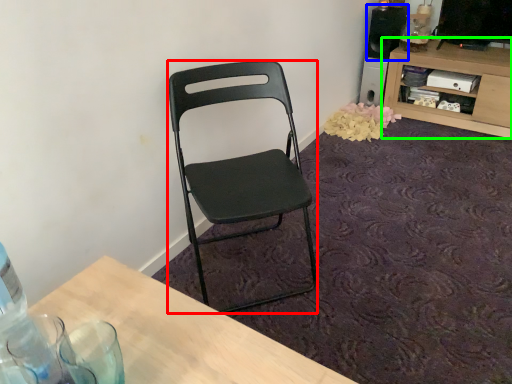
Question: Based on their relative distances, which object is farther from chair (highlighted by a red box)? Choose from loudspeaker (highlighted by a blue box) and shelf (highlighted by a green box).

Choices:
 (A) loudspeaker
 (B) shelf

Answer: (A)